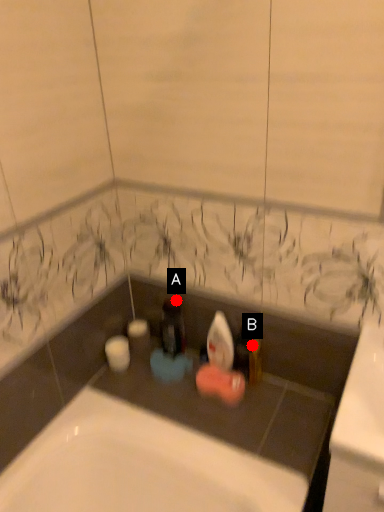
Question: Two points are circled on the image, labeled by A and B beside each circle. Which of the following is the farthest from the observer?

Choices:
 (A) A is further
 (B) B is further

Answer: (A)